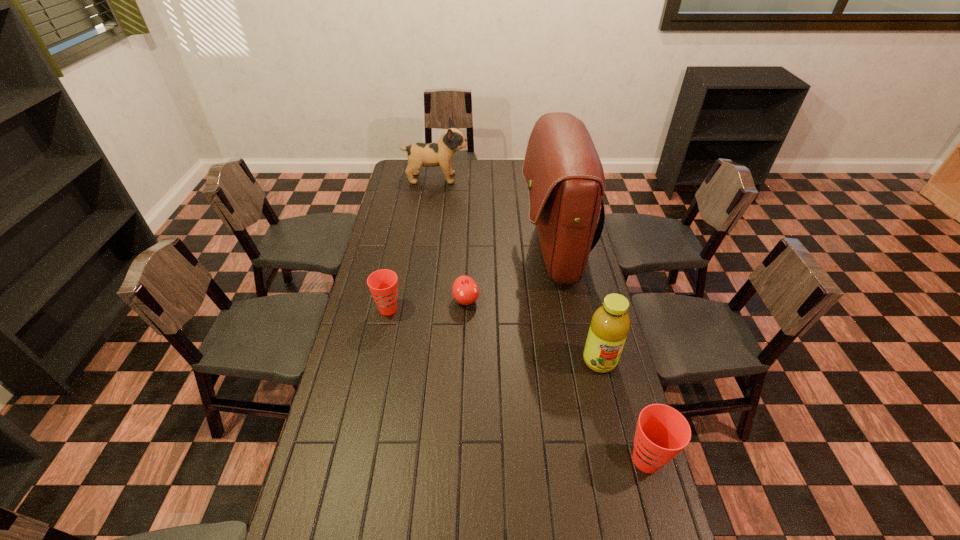
Image resolution: width=960 pixels, height=540 pixels. Find the location of `fruit juice positioned at the right edge`. fruit juice positioned at the right edge is located at coordinates (610, 324).

Locate an element on the screen. The width and height of the screenshot is (960, 540). satchel at the right edge is located at coordinates (564, 175).

Where is `object situated at the far left corner`? Image resolution: width=960 pixels, height=540 pixels. object situated at the far left corner is located at coordinates (440, 153).

Where is `vacant area at the near edge`? The image size is (960, 540). vacant area at the near edge is located at coordinates (541, 534).

At what (x,y) coordinates should I click in order to perform the action: click on free region at the left edge of the desktop. Please return your answer as a coordinate pair (x, y). Looking at the image, I should click on (397, 214).

The height and width of the screenshot is (540, 960). Identify the location of free space at the right edge. 593,272.

The width and height of the screenshot is (960, 540). I want to click on free space between the puppy and the nearest object, so click(541, 319).

At what (x,y) coordinates should I click in order to perform the action: click on vacant area that lies between the farthest object and the apple. Please return your answer as a coordinate pair (x, y). The height and width of the screenshot is (540, 960). Looking at the image, I should click on (451, 239).

You are a GUI agent. You are given a task and a screenshot of the screen. Output one action in this format:
    pyautogui.click(x=<x>, y=<y>)
    Task: Click on the empty space between the fruit juice and the nearest object
    
    Given the screenshot: What is the action you would take?
    pyautogui.click(x=623, y=410)

The height and width of the screenshot is (540, 960). I want to click on free space between the nearest object and the apple, so click(x=556, y=380).